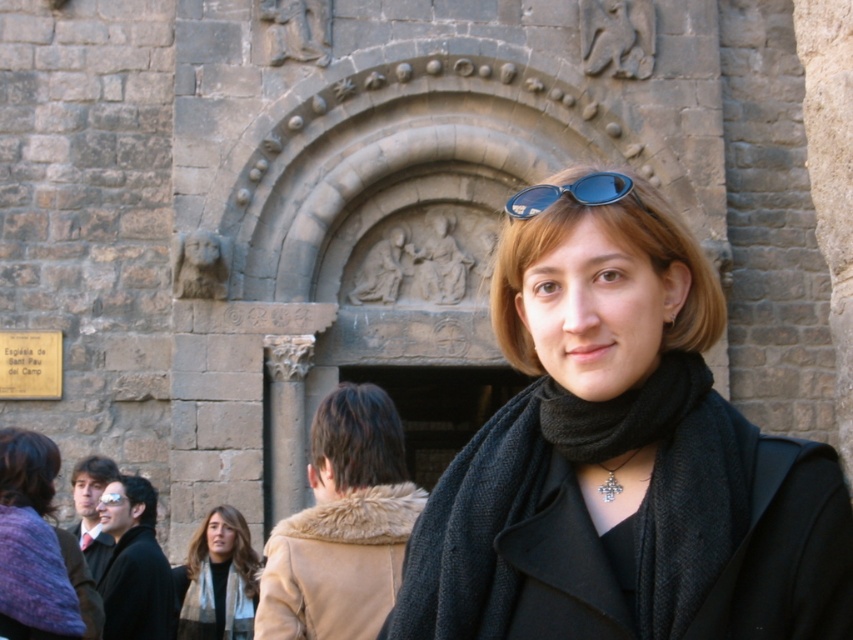
Question: Is black woolen scarf at center bigger than blue reflective lenses at upper center?

Choices:
 (A) no
 (B) yes

Answer: (B)

Question: Does black matte scarf at center come behind dark brown hair at center?

Choices:
 (A) no
 (B) yes

Answer: (A)

Question: Estimate the real-world distances between objects in this image. Which object is farther from the black wool scarf at center?

Choices:
 (A) blue reflective lenses at upper center
 (B) dark brown hair at center
 (C) beige fur coat at center
 (D) light brown scarf at lower left

Answer: (D)

Question: Is black matte scarf at center behind purple wool scarf at lower left?

Choices:
 (A) no
 (B) yes

Answer: (A)

Question: Which object is the farthest from the light brown scarf at lower left?

Choices:
 (A) black wool scarf at center
 (B) dark brown hair at center

Answer: (A)

Question: Which object is closer to the camera taking this photo?

Choices:
 (A) dark brown hair at center
 (B) matte black goggles at center

Answer: (A)